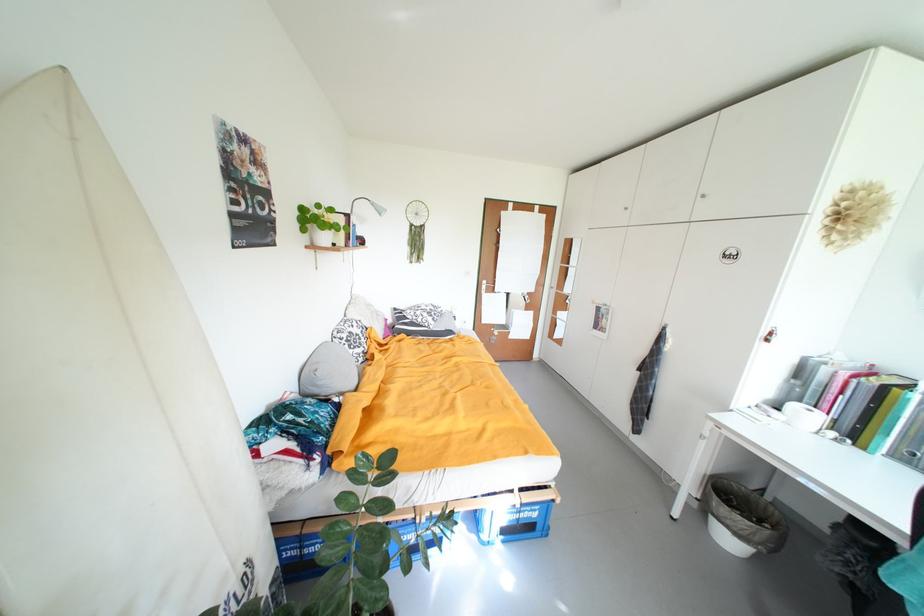
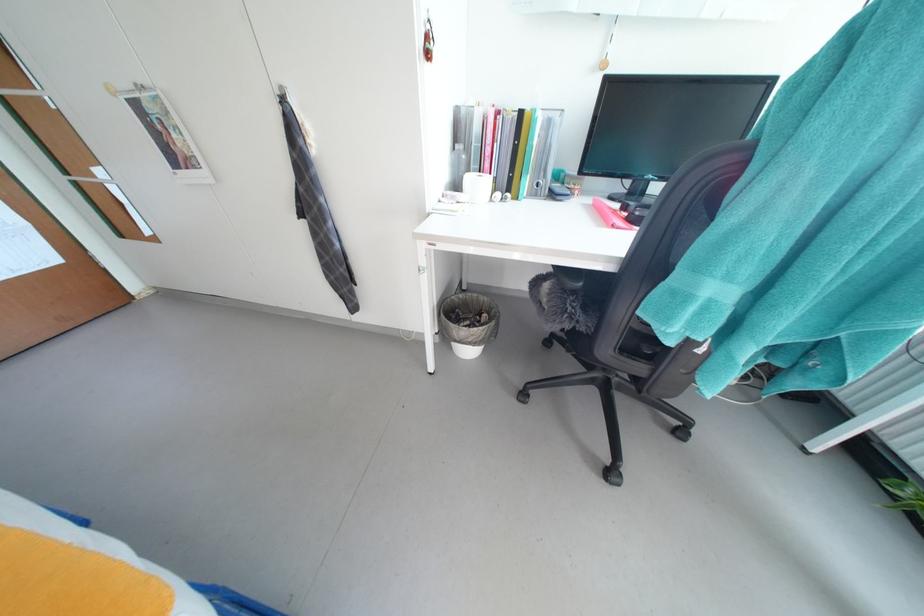
The point at (844, 423) is marked in the first image. Where is the corresponding point in the second image?

(503, 182)